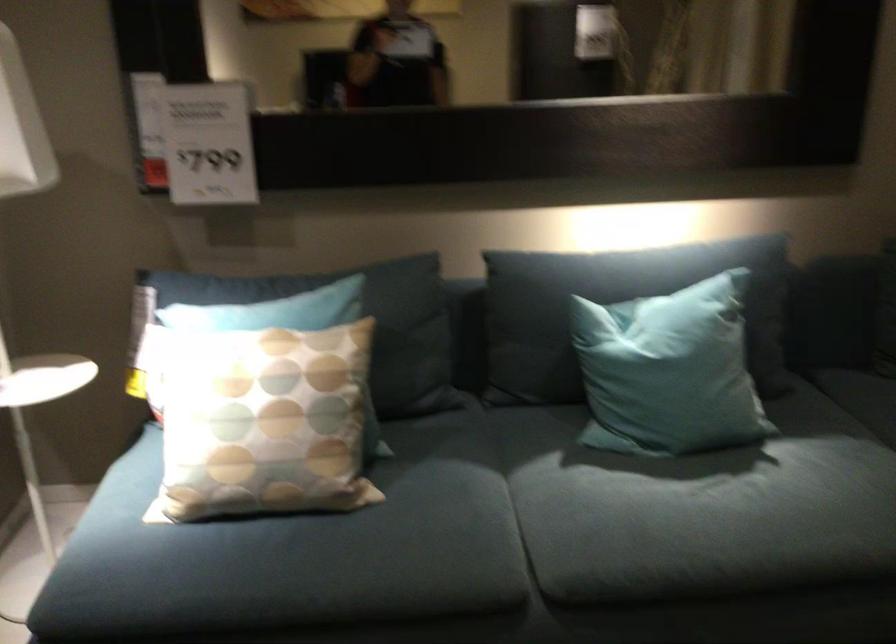
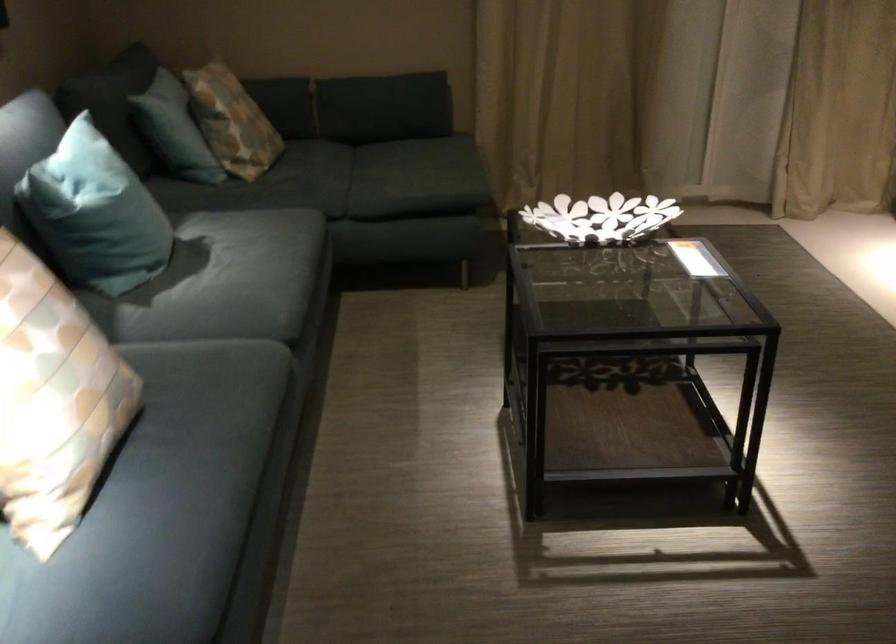
Locate, in the second image, the point that corresponds to pixel 204 428 in the first image.

(53, 401)